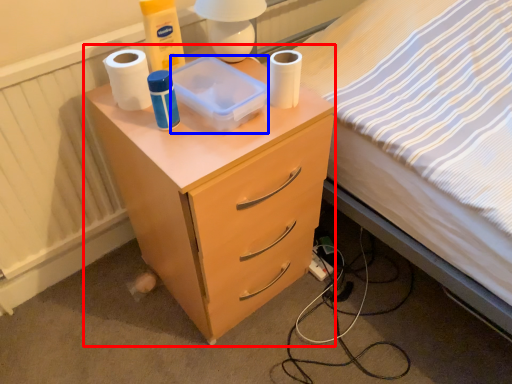
Question: Among these objects, which one is nearest to the camera, nightstand (highlighted by a red box) or box (highlighted by a blue box)?

Choices:
 (A) nightstand
 (B) box

Answer: (A)